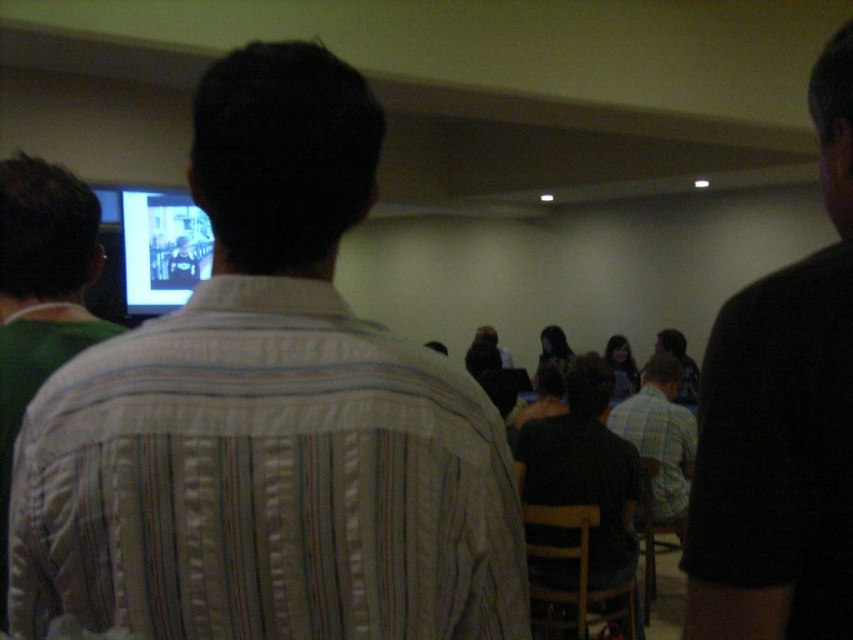
Does white striped shirt at center have a lesser height compared to black glossy screen at upper left?

Indeed, white striped shirt at center has a lesser height compared to black glossy screen at upper left.

Does white striped shirt at center appear over black glossy screen at upper left?

Incorrect, white striped shirt at center is not positioned above black glossy screen at upper left.

Where is `white striped shirt at center`? The image size is (853, 640). white striped shirt at center is located at coordinates (268, 417).

Is dark gray shirt at center shorter than plaid cotton shirt at center?

No, dark gray shirt at center is not shorter than plaid cotton shirt at center.

Can you confirm if dark gray shirt at center is positioned to the right of plaid cotton shirt at center?

In fact, dark gray shirt at center is to the left of plaid cotton shirt at center.

Who is more distant from viewer, (x=525, y=532) or (x=654, y=480)?

Point (x=654, y=480)

This screenshot has height=640, width=853. Identify the location of dark gray shirt at center. (584, 468).

Is white striped shirt at center taller than black matte shirt at right?

Incorrect, white striped shirt at center's height is not larger of black matte shirt at right's.

Which is in front, point (306, 365) or point (805, 518)?

Point (805, 518) is more forward.

Which is in front, point (189, 637) or point (752, 564)?

Point (189, 637)

Image resolution: width=853 pixels, height=640 pixels. In order to click on white striped shirt at center in this screenshot , I will do (268, 417).